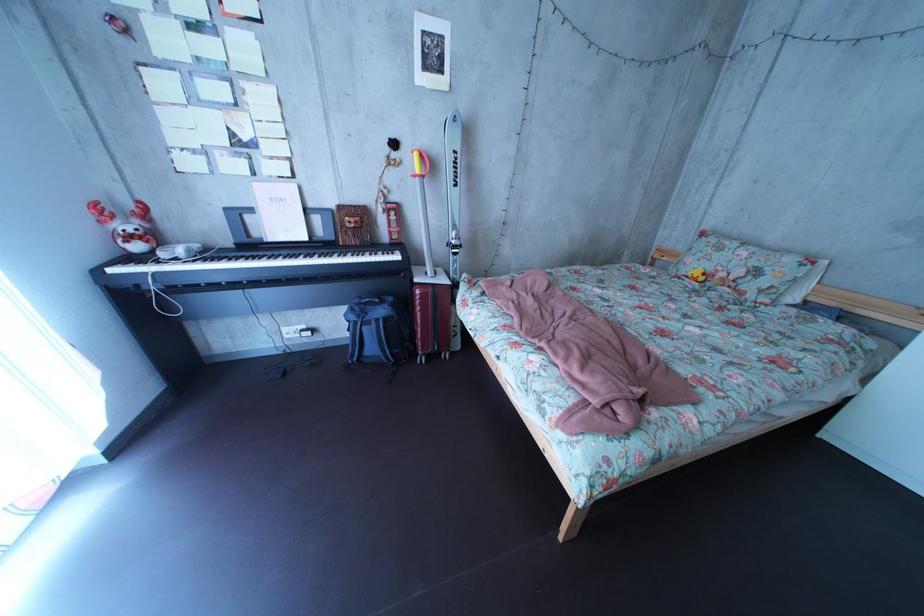
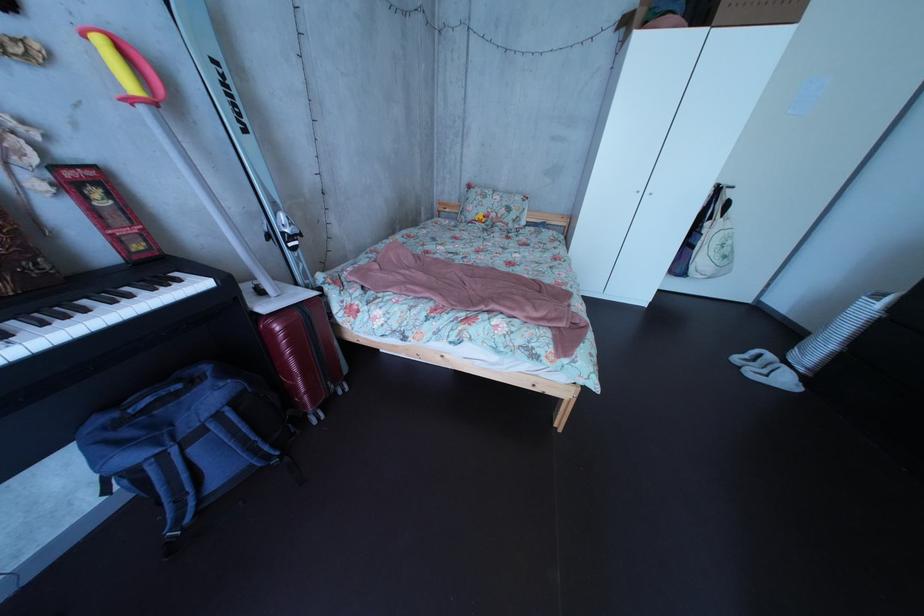
Where in the second image is the point corresponding to (444,298) from the first image?

(311, 322)